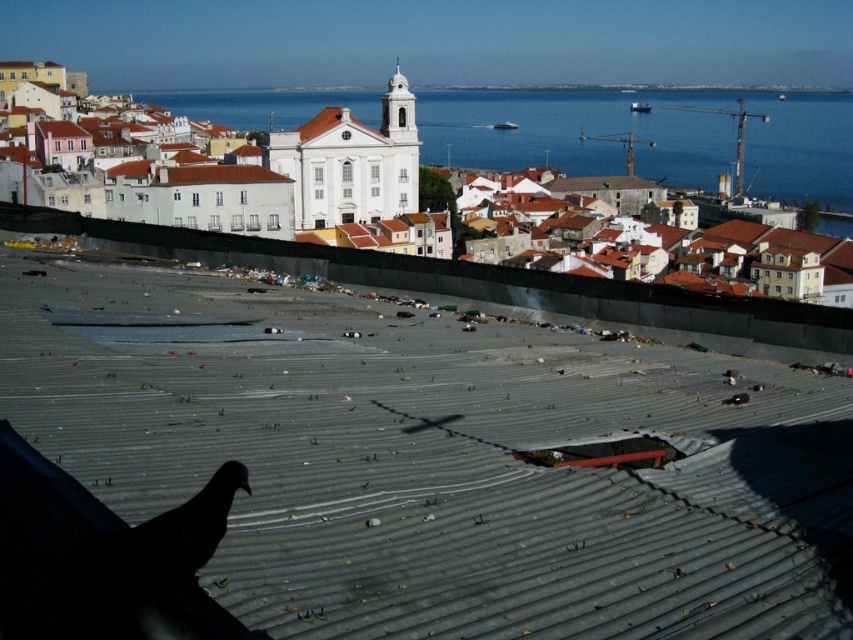
Question: Based on their relative distances, which object is nearer to the metallic harbor at center?

Choices:
 (A) white matte church at center
 (B) blue water at center
 (C) black matte bird at lower left

Answer: (C)

Question: Does blue water at center have a larger size compared to white plastic boat at upper center?

Choices:
 (A) yes
 (B) no

Answer: (A)

Question: Which point is closer to the camera taking this photo?

Choices:
 (A) (132, 531)
 (B) (641, 112)

Answer: (A)

Question: Where is metallic harbor at center located in relation to brown tile roof at center in the image?

Choices:
 (A) below
 (B) above

Answer: (A)

Question: Is metallic harbor at center further to camera compared to white plastic boat at center?

Choices:
 (A) no
 (B) yes

Answer: (A)

Question: Which point is farther to the camera?

Choices:
 (A) pyautogui.click(x=252, y=172)
 (B) pyautogui.click(x=572, y=125)

Answer: (B)